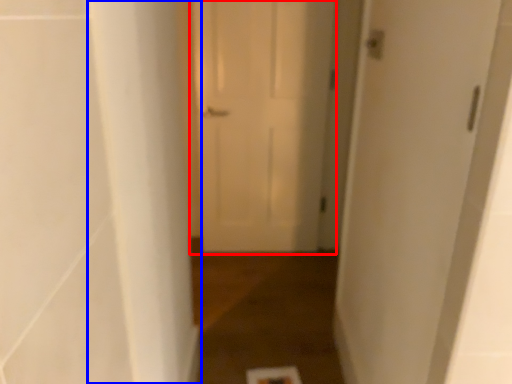
Question: Which of the following is the farthest to the observer, door (highlighted by a red box) or pillar (highlighted by a blue box)?

Choices:
 (A) door
 (B) pillar

Answer: (A)